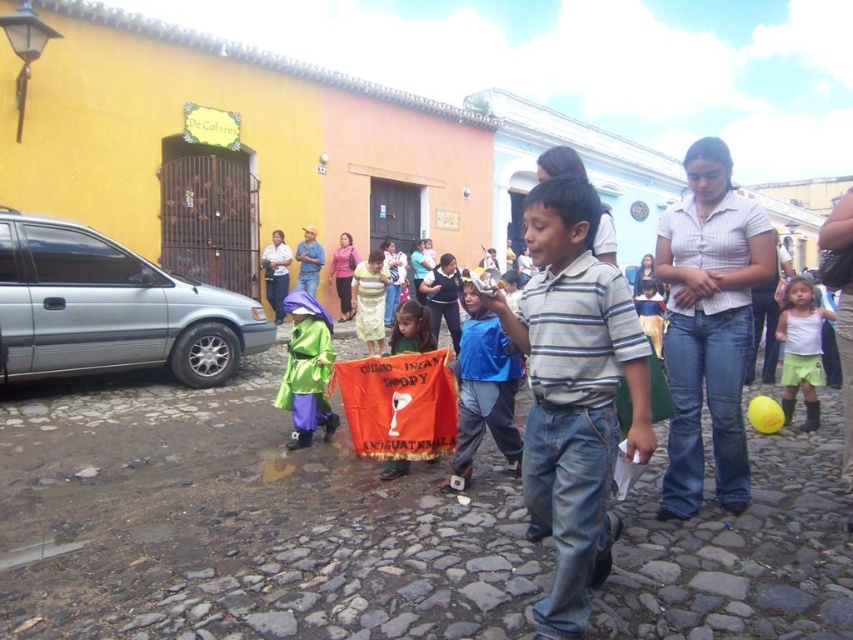
Looking at this image, is blue cotton shirt at center behind white matte shirt at center?

No, it is in front of white matte shirt at center.

Is point (459, 444) less distant than point (788, 284)?

Yes, it is in front of point (788, 284).

Does point (500, 330) lie behind point (828, 310)?

No, (500, 330) is in front of (828, 310).

The height and width of the screenshot is (640, 853). What are the coordinates of `blue cotton shirt at center` in the screenshot? It's located at (485, 388).

Is striped cotton shirt at center shorter than white matte shirt at center?

No, striped cotton shirt at center is not shorter than white matte shirt at center.

Is striped cotton shirt at center bigger than white matte shirt at center?

No.

Does point (595, 310) come farther from viewer compared to point (793, 337)?

No.

This screenshot has width=853, height=640. Identify the location of striped cotton shirt at center. (573, 394).

Measure the distance between striped cotton shirt at center and blue cotton shirt at center.

The distance of striped cotton shirt at center from blue cotton shirt at center is 38.28 inches.

Who is shorter, striped cotton shirt at center or blue cotton shirt at center?

With less height is blue cotton shirt at center.

The height and width of the screenshot is (640, 853). I want to click on striped cotton shirt at center, so click(x=573, y=394).

I want to click on striped cotton shirt at center, so click(573, 394).